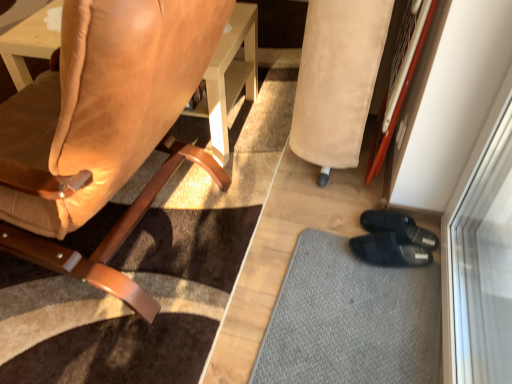
Question: Is suede leather chair at left wider or thinner than gray textured mat at lower right?

Choices:
 (A) wide
 (B) thin

Answer: (A)

Question: From the image's perspective, is suede leather chair at left positioned above or below gray textured mat at lower right?

Choices:
 (A) below
 (B) above

Answer: (B)

Question: Which of these objects is positioned farthest from the suede leather chair at left?

Choices:
 (A) beige suede bean bag chair at lower right
 (B) gray textured mat at lower right

Answer: (B)

Question: Estimate the real-world distances between objects in this image. Which object is farther from the gray textured mat at lower right?

Choices:
 (A) beige suede bean bag chair at lower right
 (B) suede leather chair at left

Answer: (B)